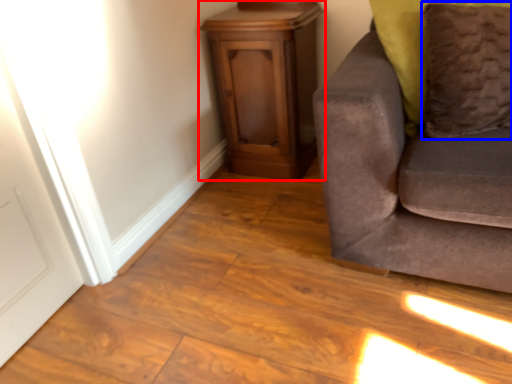
Question: Which object appears farthest to the camera in this image, furniture (highlighted by a red box) or pillow (highlighted by a blue box)?

Choices:
 (A) furniture
 (B) pillow

Answer: (A)